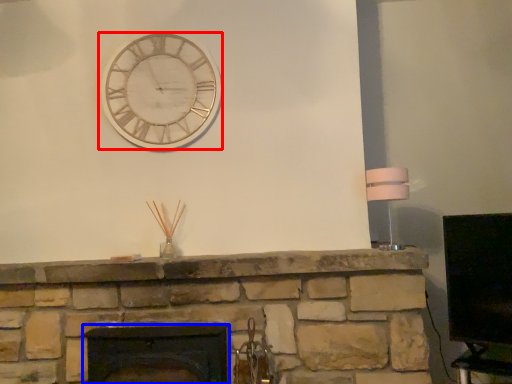
Question: Which object appears farthest to the camera in this image, wall clock (highlighted by a red box) or fireplace (highlighted by a blue box)?

Choices:
 (A) wall clock
 (B) fireplace

Answer: (A)